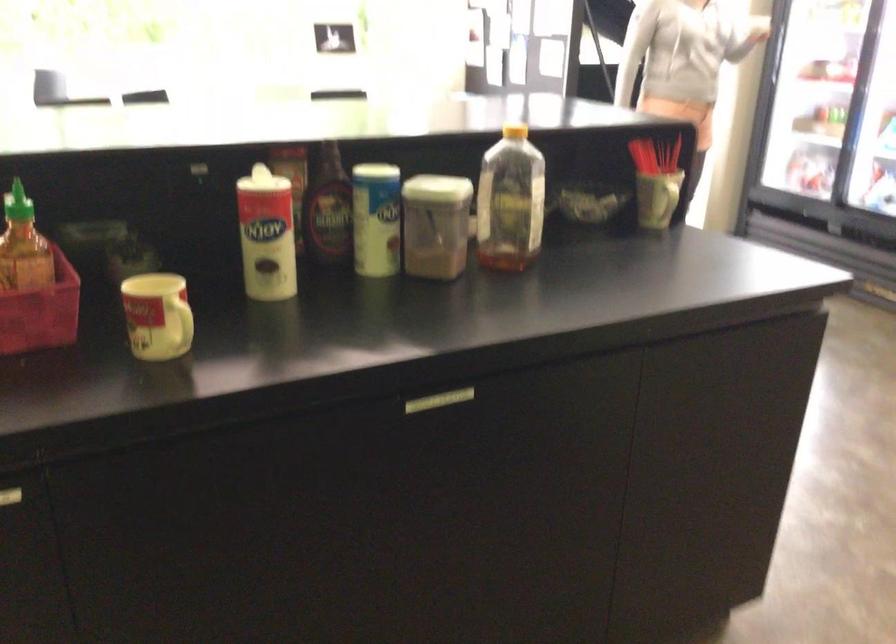
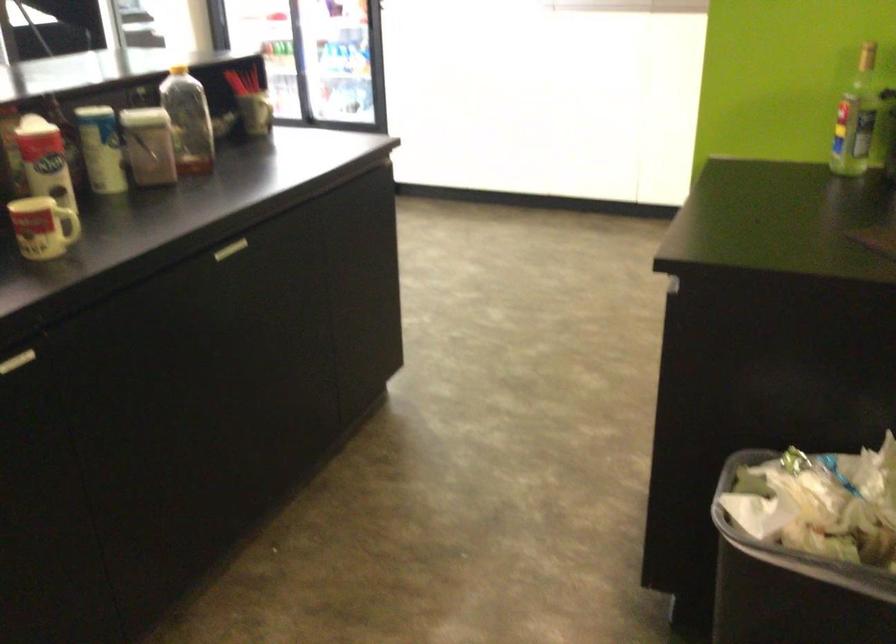
In the second image, find the point that corresponds to the point at 165,319 in the first image.

(66, 225)